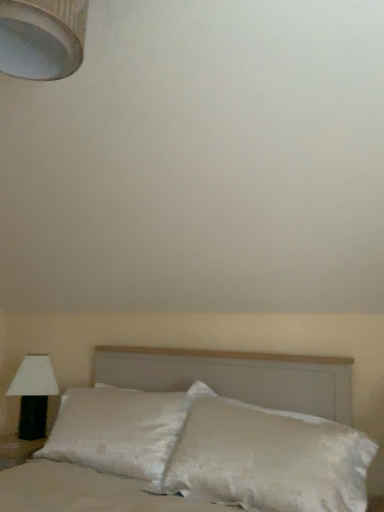
This screenshot has height=512, width=384. What do you see at coordinates (41, 38) in the screenshot? I see `white textured lampshade at upper left, the second lamp positioned from the bottom` at bounding box center [41, 38].

The image size is (384, 512). What do you see at coordinates (200, 437) in the screenshot? I see `white satin bed at center` at bounding box center [200, 437].

Where is `white textured lampshade at upper left, the second lamp positioned from the bottom`? Image resolution: width=384 pixels, height=512 pixels. white textured lampshade at upper left, the second lamp positioned from the bottom is located at coordinates (41, 38).

Can you confirm if white textured lampshade at upper left, the second lamp positioned from the bottom, is taller than white satin bed at center?

In fact, white textured lampshade at upper left, the second lamp positioned from the bottom, may be shorter than white satin bed at center.

Locate an element on the screen. Image resolution: width=384 pixels, height=512 pixels. bed below the white textured lampshade at upper left, which is the first lamp in top-to-bottom order (from a real-world perspective) is located at coordinates (200, 437).

Based on the photo, is white textured lampshade at upper left, which is the first lamp in top-to-bottom order, wider or thinner than white satin bed at center?

white textured lampshade at upper left, which is the first lamp in top-to-bottom order, is thinner than white satin bed at center.

I want to click on bed above the white satin pillow at center (from the image's perspective), so click(x=200, y=437).

From a real-world perspective, which is physically above, white satin bed at center or white satin pillow at center?

white satin bed at center, from a real-world perspective.

Is white satin bed at center positioned with its back to white satin pillow at center?

No.

Consider the image. Is white satin bed at center smaller than white satin pillow at center?

Incorrect, white satin bed at center is not smaller in size than white satin pillow at center.

How different are the orientations of white satin bed at center and black fabric lamp at left, which is counted as the 1th lamp, starting from the bottom, in degrees?

white satin bed at center and black fabric lamp at left, which is counted as the 1th lamp, starting from the bottom, are facing 0.00274 degrees away from each other.

How much distance is there between white satin bed at center and black fabric lamp at left, which is counted as the 1th lamp, starting from the bottom?

33.56 inches.

Image resolution: width=384 pixels, height=512 pixels. I want to click on bed beneath the black fabric lamp at left, acting as the second lamp starting from the front (from a real-world perspective), so click(200, 437).

From a real-world perspective, does white satin bed at center stand above black fabric lamp at left, acting as the second lamp starting from the front?

No.

Would you say white satin bed at center is part of black fabric lamp at left, which is the first lamp in left-to-right order,'s contents?

No, black fabric lamp at left, which is the first lamp in left-to-right order, does not contain white satin bed at center.

Considering the relative positions of black fabric lamp at left, which is counted as the 1th lamp, starting from the bottom, and white satin bed at center in the image provided, is black fabric lamp at left, which is counted as the 1th lamp, starting from the bottom, to the right of white satin bed at center from the viewer's perspective?

Incorrect, black fabric lamp at left, which is counted as the 1th lamp, starting from the bottom, is not on the right side of white satin bed at center.

Is the surface of black fabric lamp at left, which is the 2th lamp in right-to-left order, in direct contact with white satin bed at center?

No, black fabric lamp at left, which is the 2th lamp in right-to-left order, is not making contact with white satin bed at center.

From the picture: Which object is thinner, black fabric lamp at left, which is the 1th lamp in back-to-front order, or white satin bed at center?

With smaller width is black fabric lamp at left, which is the 1th lamp in back-to-front order.

From the image's perspective, between white satin pillow at center and white satin bed at center, which one is located above?

white satin bed at center.

Is point (189, 394) closer to camera compared to point (216, 403)?

No, it is not.

From a real-world perspective, relative to white satin bed at center, is white satin pillow at center vertically above or below?

Clearly, from a real-world perspective, white satin pillow at center is below white satin bed at center.

Does point (94, 390) come farther from viewer compared to point (29, 411)?

No, (94, 390) is closer to viewer.

Measure the distance from white satin pillow at center to black fabric lamp at left, which is the first lamp in left-to-right order.

The distance of white satin pillow at center from black fabric lamp at left, which is the first lamp in left-to-right order, is 24.51 inches.

Is white satin pillow at center turned away from black fabric lamp at left, which is the 2th lamp in right-to-left order?

No, white satin pillow at center is not facing away from black fabric lamp at left, which is the 2th lamp in right-to-left order.

From a real-world perspective, which object stands above the other?

black fabric lamp at left, which is the second lamp in top-to-bottom order.

Is white textured lampshade at upper left, the second lamp positioned from the bottom, aimed at black fabric lamp at left, which is counted as the 1th lamp, starting from the bottom?

No.

Considering the relative positions of white textured lampshade at upper left, which is the first lamp in top-to-bottom order, and black fabric lamp at left, which is the 2th lamp in right-to-left order, in the image provided, is white textured lampshade at upper left, which is the first lamp in top-to-bottom order, behind black fabric lamp at left, which is the 2th lamp in right-to-left order,?

No, the depth of white textured lampshade at upper left, which is the first lamp in top-to-bottom order, is less than that of black fabric lamp at left, which is the 2th lamp in right-to-left order.

Which of these two, white textured lampshade at upper left, which is counted as the 2th lamp, starting from the back, or black fabric lamp at left, which is counted as the 1th lamp, starting from the bottom, is bigger?

With larger size is black fabric lamp at left, which is counted as the 1th lamp, starting from the bottom.

There is a black fabric lamp at left, which is the 2th lamp in right-to-left order. Where is `lamp above it (from a real-world perspective)`? This screenshot has height=512, width=384. lamp above it (from a real-world perspective) is located at coordinates (41, 38).

Locate an element on the screen. lamp above the white satin bed at center (from the image's perspective) is located at coordinates (41, 38).

Find the location of a particular element. This screenshot has width=384, height=512. pillow that appears below the white satin bed at center (from a real-world perspective) is located at coordinates (121, 430).

Looking at the image, which one is located further to white textured lampshade at upper left, placed as the first lamp when sorted from right to left, black fabric lamp at left, which is the 1th lamp in back-to-front order, or white satin pillow at center?

black fabric lamp at left, which is the 1th lamp in back-to-front order, is positioned further to the anchor white textured lampshade at upper left, placed as the first lamp when sorted from right to left.

From the image, which object appears to be farther from white textured lampshade at upper left, acting as the second lamp starting from the left, black fabric lamp at left, which is the 2th lamp in right-to-left order, or white satin bed at center?

black fabric lamp at left, which is the 2th lamp in right-to-left order, is positioned further to the anchor white textured lampshade at upper left, acting as the second lamp starting from the left.

Based on their spatial positions, is black fabric lamp at left, which is the 1th lamp in back-to-front order, or white textured lampshade at upper left, which is the first lamp in top-to-bottom order, further from white satin pillow at center?

white textured lampshade at upper left, which is the first lamp in top-to-bottom order, is positioned further to the anchor white satin pillow at center.

From the picture: Looking at the image, which one is located further to white satin bed at center, white satin pillow at center or black fabric lamp at left, which is the first lamp in left-to-right order?

black fabric lamp at left, which is the first lamp in left-to-right order, is positioned further to the anchor white satin bed at center.

Looking at the image, which one is located further to black fabric lamp at left, which is the second lamp in top-to-bottom order, white satin bed at center or white satin pillow at center?

white satin bed at center lies further to black fabric lamp at left, which is the second lamp in top-to-bottom order, than the other object.

Considering their positions, is white satin bed at center positioned closer to white textured lampshade at upper left, which is counted as the 2th lamp, starting from the back, than black fabric lamp at left, which is the first lamp in left-to-right order?

white satin bed at center is closer to white textured lampshade at upper left, which is counted as the 2th lamp, starting from the back.

Based on their spatial positions, is white satin pillow at center or black fabric lamp at left, which is counted as the 1th lamp, starting from the bottom, further from white textured lampshade at upper left, the second lamp positioned from the bottom?

black fabric lamp at left, which is counted as the 1th lamp, starting from the bottom, is further to white textured lampshade at upper left, the second lamp positioned from the bottom.

Estimate the real-world distances between objects in this image. Which object is closer to white satin bed at center, white textured lampshade at upper left, placed as the first lamp when sorted from right to left, or white satin pillow at center?

white satin pillow at center lies closer to white satin bed at center than the other object.

Identify the location of bed between white textured lampshade at upper left, positioned as the 1th lamp in front-to-back order, and white satin pillow at center, in the vertical direction. Image resolution: width=384 pixels, height=512 pixels. pos(200,437).

Image resolution: width=384 pixels, height=512 pixels. What are the coordinates of `bed between white textured lampshade at upper left, positioned as the 1th lamp in front-to-back order, and black fabric lamp at left, which is the first lamp in left-to-right order, in the up-down direction` in the screenshot? It's located at (200, 437).

Identify the location of pillow between white textured lampshade at upper left, placed as the first lamp when sorted from right to left, and black fabric lamp at left, which is the 2th lamp in right-to-left order, in the vertical direction. (121, 430).

Locate an element on the screen. The width and height of the screenshot is (384, 512). pillow situated between black fabric lamp at left, which is the 1th lamp in back-to-front order, and white satin bed at center from left to right is located at coordinates (121, 430).